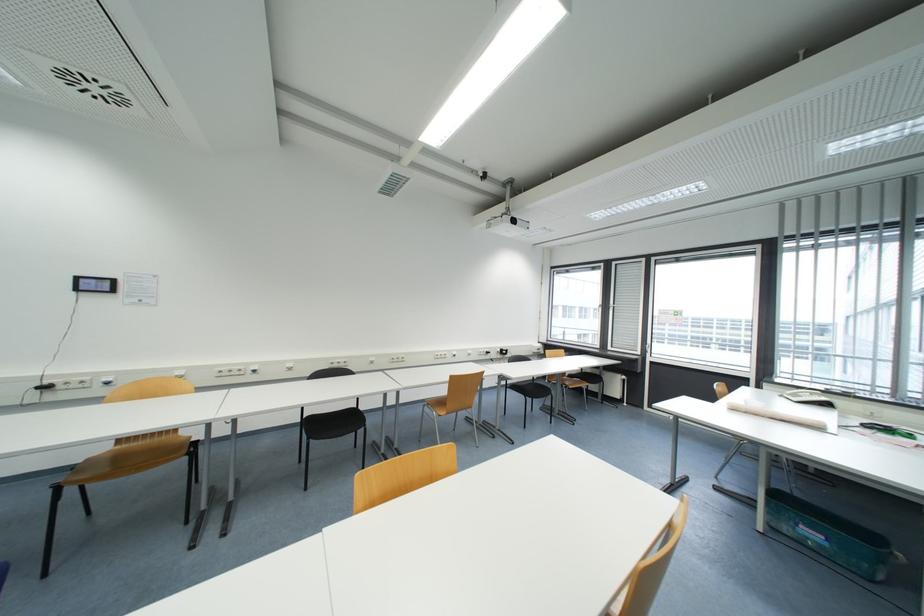
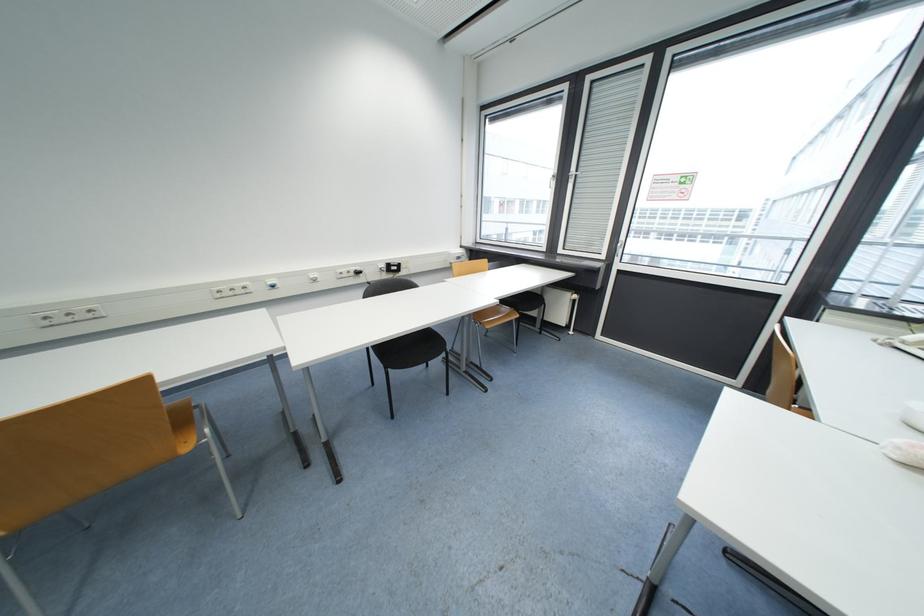
The point at [618,265] is marked in the first image. Where is the corresponding point in the second image?

(593, 81)